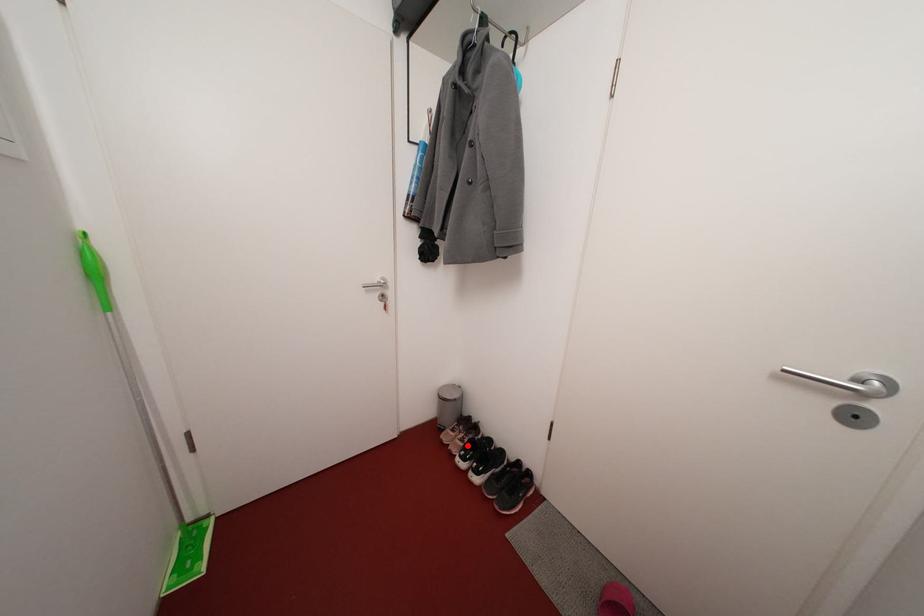
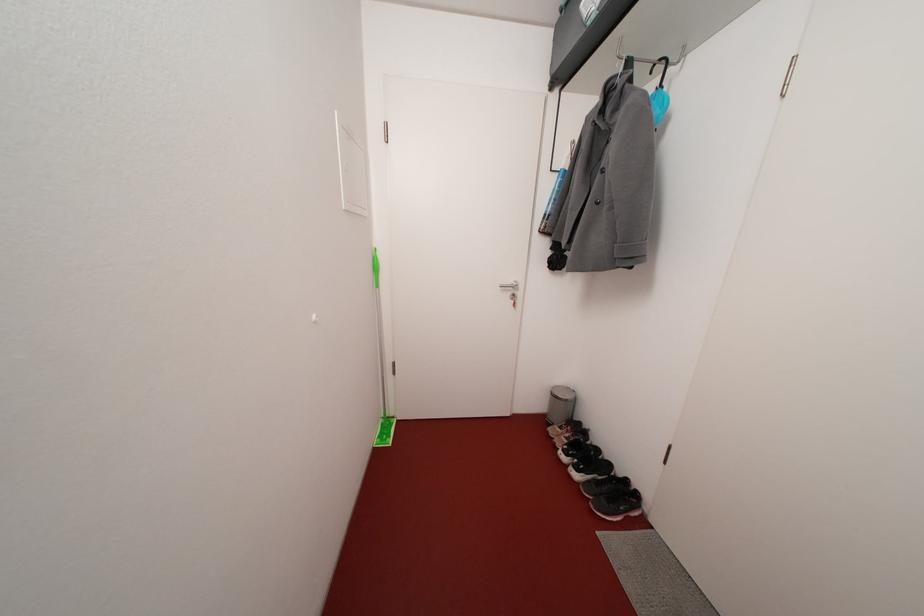
The point at the highlighted location is marked in the first image. Where is the corresponding point in the second image?

(574, 444)